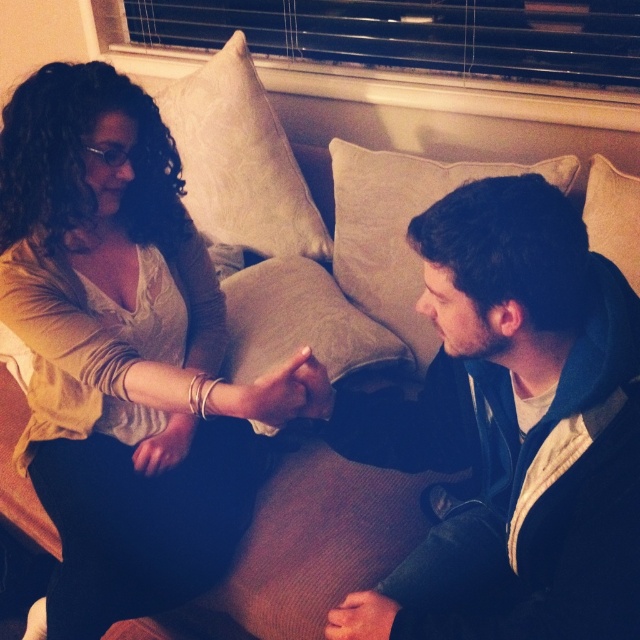
You are a delivery person who needs to place a small package between the beige fabric pillow at center and the beige fabric pillow at upper right on the couch. Can you fit the package if it measures 14 inches in length?

The distance between the beige fabric pillow at center and the beige fabric pillow at upper right is 13.92 inches. Since the package is 14 inches long, it would be slightly too long to fit between them.

You are standing in the living room and want to take a photo of the point at coordinates (x=540, y=560). The camera you have can only focus on objects within 1 meter. Will the point be in focus?

The point at coordinates (x=540, y=560) is 1.05 meters away from the camera, which is slightly beyond the camera focus limit of 1 meter. Therefore, the point will not be in focus.

You are designing a new seating arrangement for this living room. You need to place a decorative throw blanket that is 1.2 meters wide on either the matte beige sweater at upper left or the beige fabric pillow at upper right. Based on their sizes, which object can the throw blanket fit over without hanging off the edges?

The matte beige sweater at upper left is wider than the beige fabric pillow at upper right. Since the throw blanket is 1.2 meters wide, it would fit better over the matte beige sweater at upper left as it has sufficient width to accommodate the blanket without it hanging off the edges.